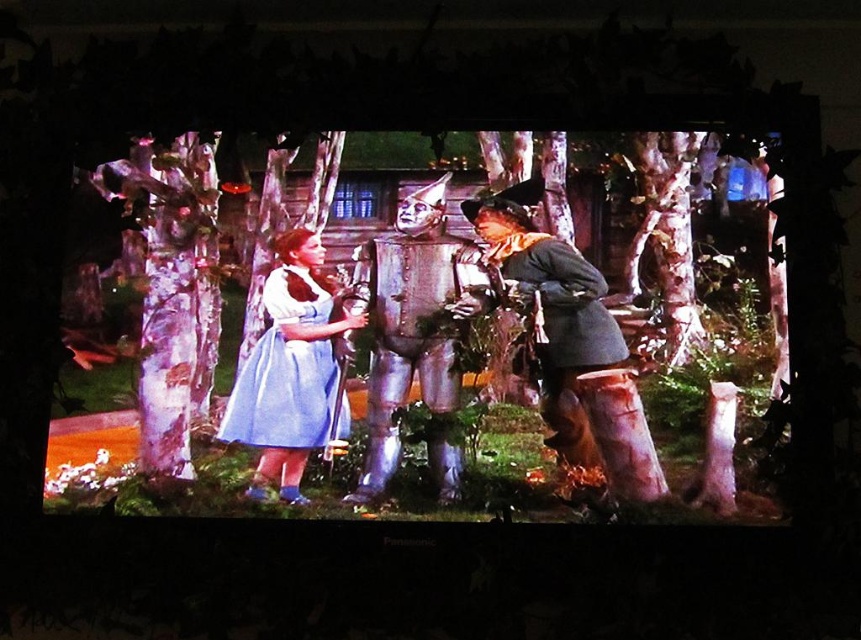
Question: Is metallic silver robot at center thinner than light blue satin dress at center?

Choices:
 (A) yes
 (B) no

Answer: (B)

Question: Among these points, which one is nearest to the camera?

Choices:
 (A) (388, 388)
 (B) (252, 417)

Answer: (B)

Question: Considering the real-world distances, which object is closest to the rusty metal man at center?

Choices:
 (A) metallic silver robot at center
 (B) light blue satin dress at center

Answer: (A)

Question: Does metallic silver robot at center appear under rusty metal man at center?

Choices:
 (A) no
 (B) yes

Answer: (B)

Question: Does metallic silver robot at center have a smaller size compared to light blue satin dress at center?

Choices:
 (A) no
 (B) yes

Answer: (A)

Question: Which is nearer to the light blue satin dress at center?

Choices:
 (A) rusty metal man at center
 (B) metallic silver robot at center

Answer: (B)